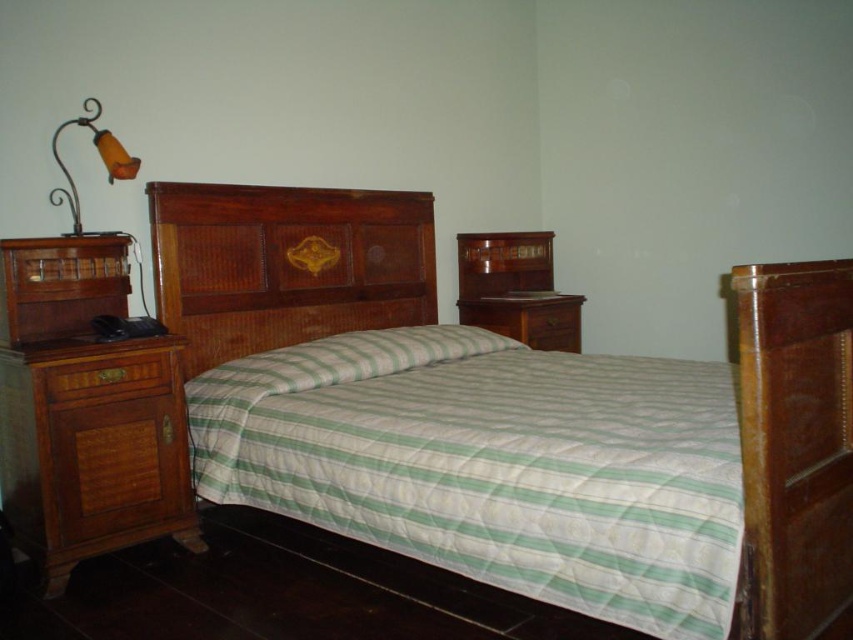
You are moving a large painting that is 1.8 meters tall. You want to place it on the wall behind either the mahogany wood armoire at center or the wooden drawer at left. Based on their heights, which object would be the better choice to place the painting above?

The mahogany wood armoire at center is much taller than the wooden drawer at left, so placing the painting above the mahogany wood armoire at center would be more appropriate as it can accommodate the painting height better.

You are trying to determine if a 1.5 meter tall painting can be placed above the wooden drawer at left without exceeding the height of the wooden bed at center. Can it fit?

The wooden bed at center is taller than the wooden drawer at left. Since the painting is 1.5 meters tall, it can be placed above the wooden drawer at left as long as the combined height of the drawer and the painting does not exceed the bed height. However, without knowing the exact height of the bed or the drawer, we cannot definitively confirm if it will fit.

You are trying to decide whether to place a large decorative plant next to the wooden bed at center and the wooden drawer at left. Based on their sizes, which object can accommodate a larger plant?

The wooden bed at center is bigger than the wooden drawer at left, so it can accommodate a larger plant.